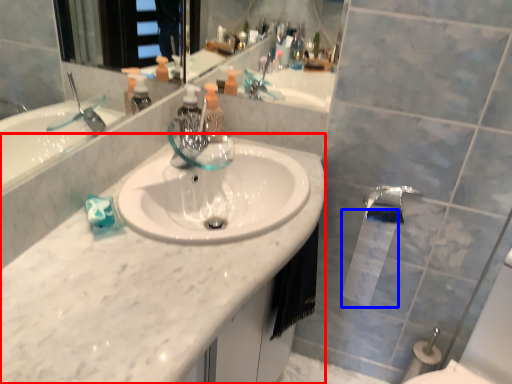
Question: Among these objects, which one is nearest to the camera, counter top (highlighted by a red box) or toilet paper (highlighted by a blue box)?

Choices:
 (A) counter top
 (B) toilet paper

Answer: (A)